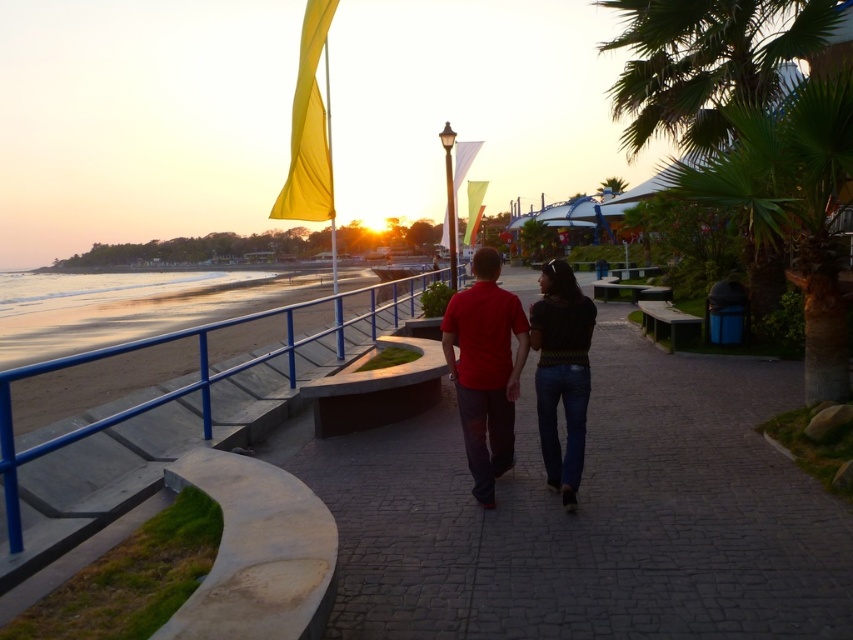
Based on the scene described, can you determine the spatial relationship between the smooth concrete pavement at center and the green leafy palm tree at upper right?

The smooth concrete pavement at center is located to the left of the green leafy palm tree at upper right.

You are standing at the point labeled point (x=473, y=547) and want to walk towards the point labeled point (x=688, y=33). Which direction should you face to move towards it?

You should face towards the left and slightly upwards because point (x=688, y=33) is located to the upper left of point (x=473, y=547).